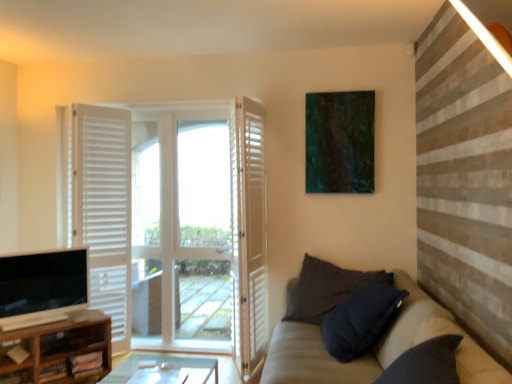
Question: From a real-world perspective, is dark textured pillow at lower right located higher than beige fabric couch at lower right?

Choices:
 (A) no
 (B) yes

Answer: (A)

Question: Is dark textured pillow at lower right positioned behind beige fabric couch at lower right?

Choices:
 (A) yes
 (B) no

Answer: (A)

Question: Does dark textured pillow at lower right have a greater height compared to beige fabric couch at lower right?

Choices:
 (A) no
 (B) yes

Answer: (B)

Question: Can you confirm if dark textured pillow at lower right is shorter than beige fabric couch at lower right?

Choices:
 (A) no
 (B) yes

Answer: (A)

Question: From a real-world perspective, is dark textured pillow at lower right positioned under beige fabric couch at lower right based on gravity?

Choices:
 (A) no
 (B) yes

Answer: (B)

Question: Considering the positions of matte black tv at lower left and white wooden door at center, which is counted as the 2th door, starting from the left, in the image, is matte black tv at lower left bigger or smaller than white wooden door at center, which is counted as the 2th door, starting from the left,?

Choices:
 (A) small
 (B) big

Answer: (A)

Question: Choose the correct answer: Is matte black tv at lower left inside white wooden door at center, which is counted as the 2th door, starting from the left, or outside it?

Choices:
 (A) outside
 (B) inside

Answer: (A)

Question: From a real-world perspective, relative to white wooden door at center, the 2th door when ordered from right to left, is matte black tv at lower left vertically above or below?

Choices:
 (A) above
 (B) below

Answer: (B)

Question: Is matte black tv at lower left in front of or behind white wooden door at center, which is counted as the 2th door, starting from the left, in the image?

Choices:
 (A) front
 (B) behind

Answer: (A)

Question: From the image's perspective, is teal matte painting at upper center located above or below brown wood cabinet at lower left?

Choices:
 (A) above
 (B) below

Answer: (A)

Question: Is teal matte painting at upper center bigger or smaller than brown wood cabinet at lower left?

Choices:
 (A) big
 (B) small

Answer: (B)

Question: Is teal matte painting at upper center wider or thinner than brown wood cabinet at lower left?

Choices:
 (A) thin
 (B) wide

Answer: (A)

Question: From a real-world perspective, is teal matte painting at upper center physically located above or below brown wood cabinet at lower left?

Choices:
 (A) below
 (B) above

Answer: (B)

Question: Is brown wood cabinet at lower left bigger or smaller than teal matte painting at upper center?

Choices:
 (A) big
 (B) small

Answer: (A)

Question: From their relative heights in the image, would you say brown wood cabinet at lower left is taller or shorter than teal matte painting at upper center?

Choices:
 (A) tall
 (B) short

Answer: (B)